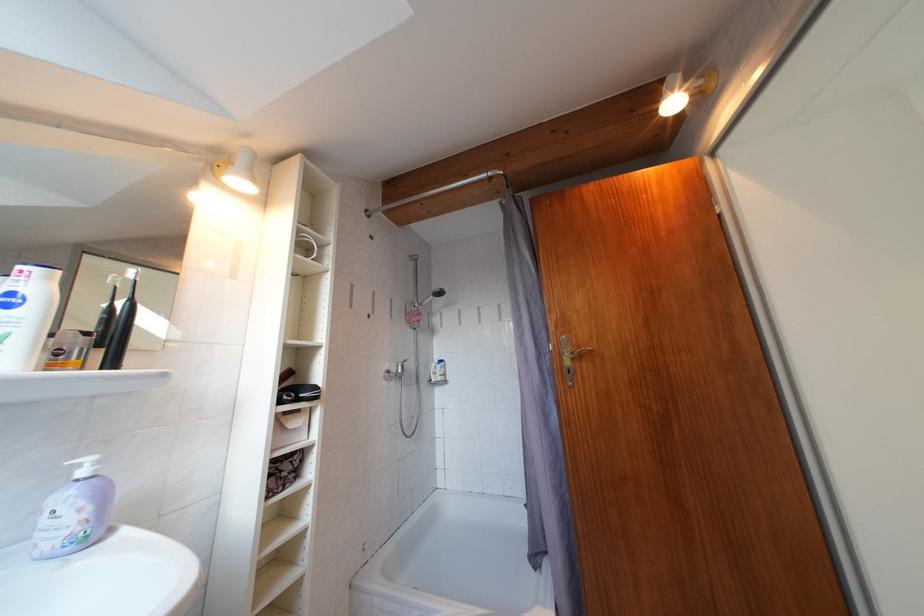
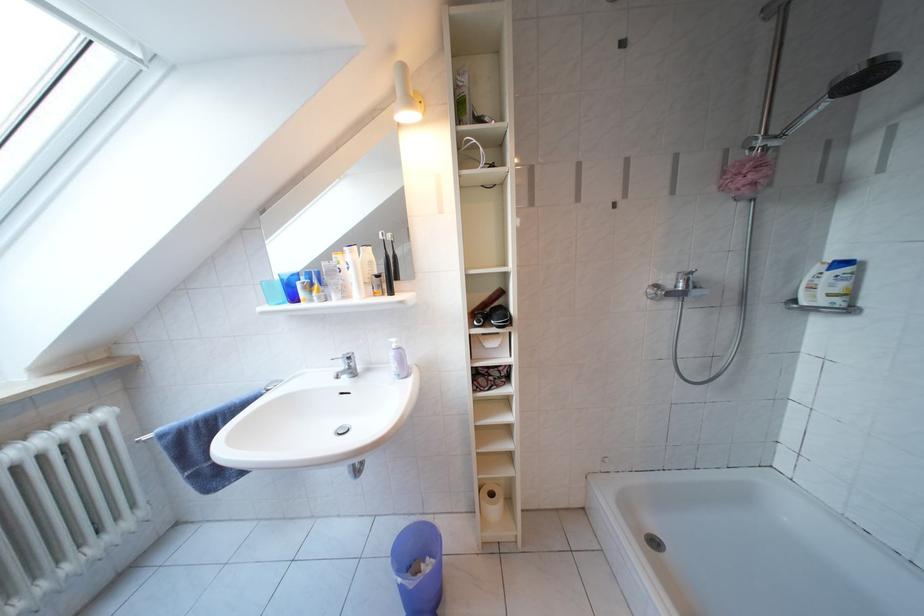
Where in the second image is the point corresponding to the point at 451,382 from the first image?

(846, 306)